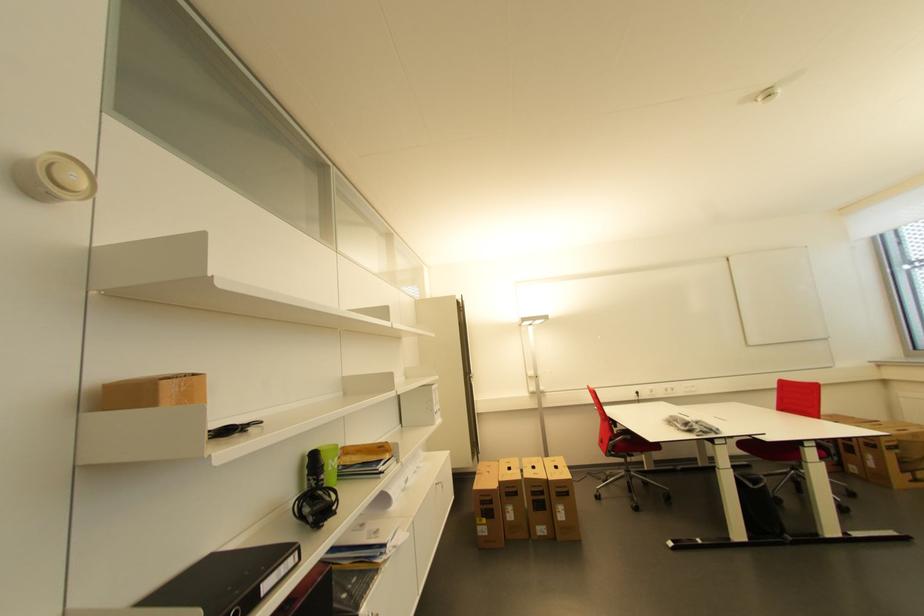
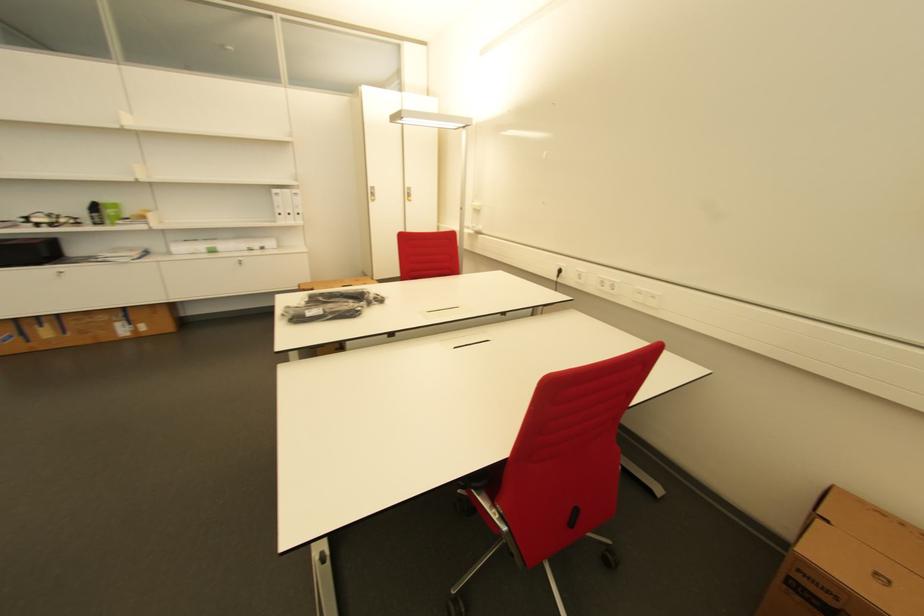
Where in the second image is the point corresponding to [675,392] from the first image?

(612, 289)